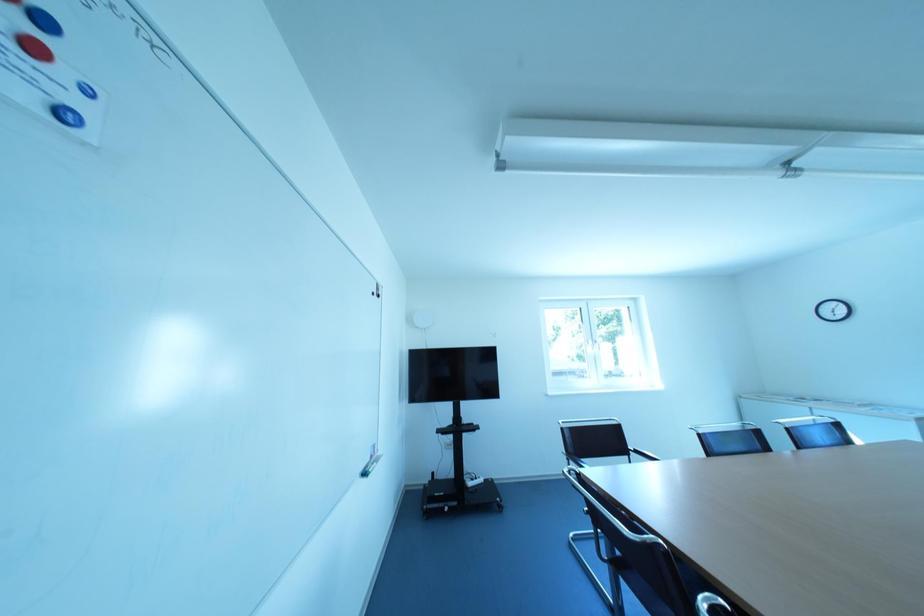
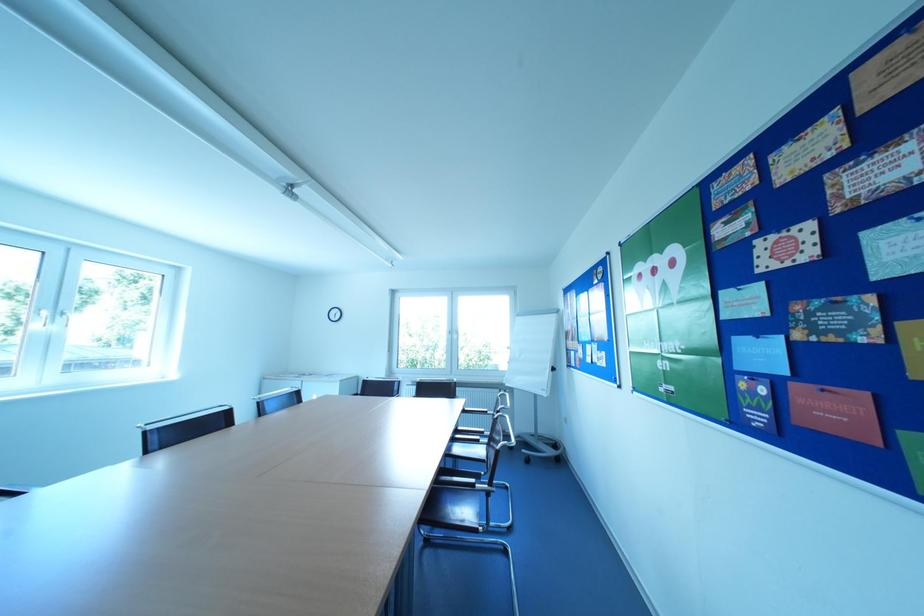
Question: The camera is either moving clockwise (left) or counter-clockwise (right) around the object. The first image is from the beginning of the video and the second image is from the end. Is the camera moving left or right when shooting the video?

Choices:
 (A) Left
 (B) Right

Answer: (A)